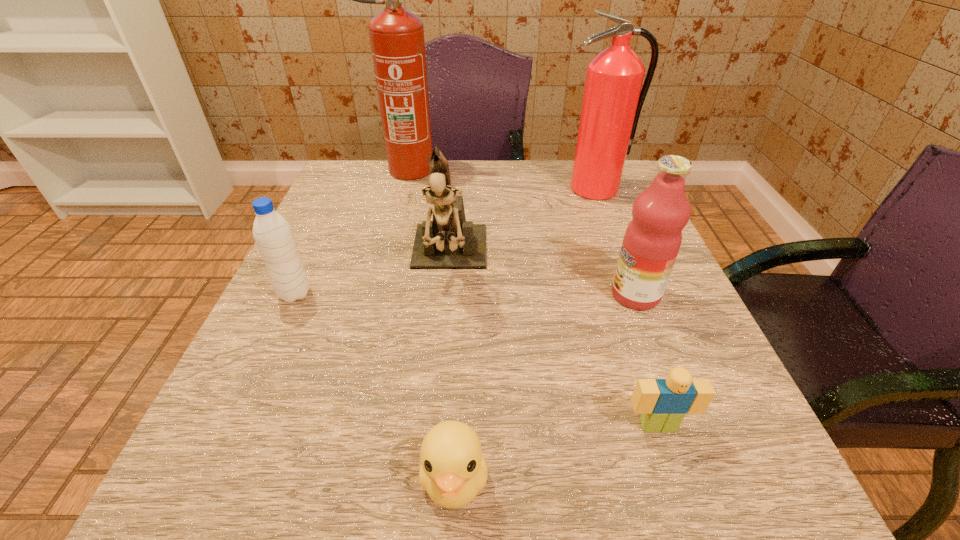
I want to click on fire extinguisher that is at the right edge, so click(x=612, y=102).

Identify the location of fruit juice situated at the right edge. This screenshot has width=960, height=540. (652, 240).

Identify the location of Lego present at the right edge. (663, 403).

At what (x,y) coordinates should I click in order to perform the action: click on object that is at the far left corner. Please return your answer as a coordinate pair (x, y). This screenshot has width=960, height=540. Looking at the image, I should click on (397, 41).

In order to click on object present at the far right corner in this screenshot , I will do `click(612, 102)`.

Image resolution: width=960 pixels, height=540 pixels. I want to click on free spot at the far edge of the desktop, so click(525, 199).

At what (x,y) coordinates should I click in order to perform the action: click on free point at the left edge. Please return your answer as a coordinate pair (x, y). Image resolution: width=960 pixels, height=540 pixels. Looking at the image, I should click on (306, 435).

The image size is (960, 540). I want to click on vacant region at the right edge of the desktop, so click(701, 339).

Where is `vacant region at the near left corner`? Image resolution: width=960 pixels, height=540 pixels. vacant region at the near left corner is located at coordinates (296, 464).

The height and width of the screenshot is (540, 960). In the image, there is a desktop. In order to click on vacant space at the far right corner in this screenshot , I will do `click(565, 185)`.